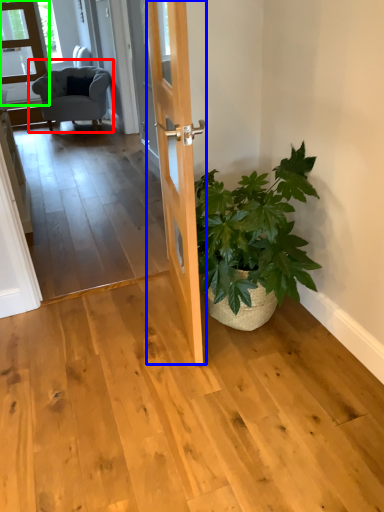
Question: Estimate the real-world distances between objects in this image. Which object is closer to chair (highlighted by a red box), door (highlighted by a blue box) or glass door (highlighted by a green box)?

Choices:
 (A) door
 (B) glass door

Answer: (B)